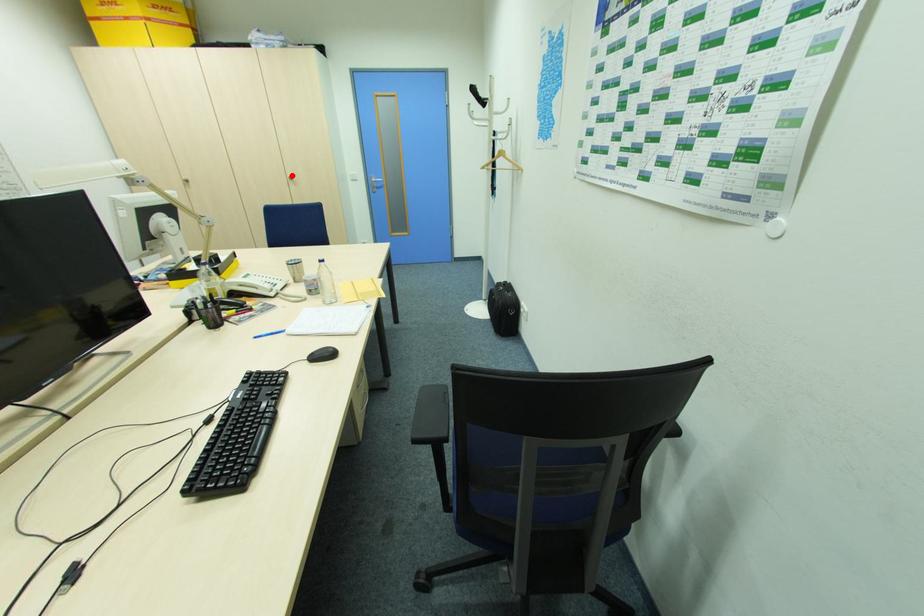
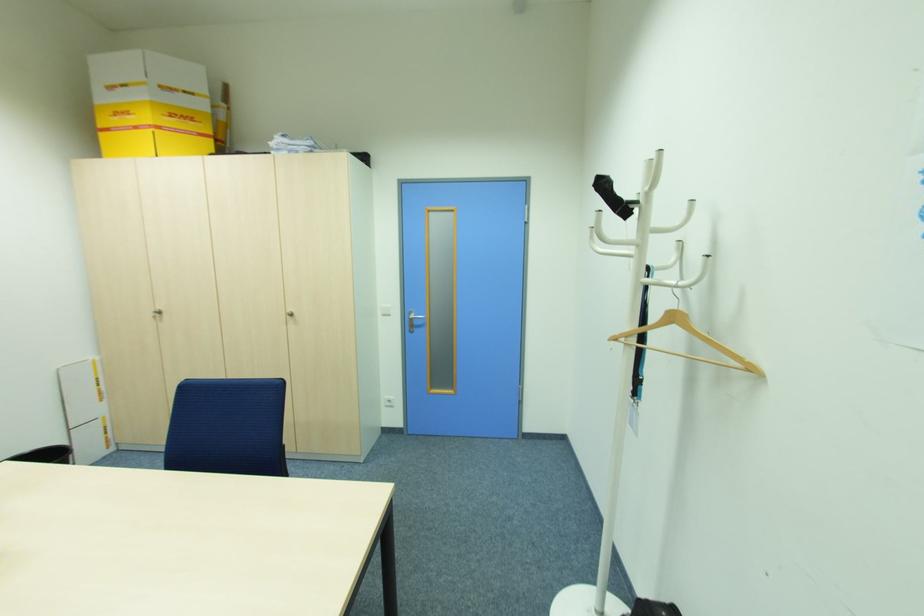
Find the pixel in the second image that matches the highlighted location in the first image.

(292, 310)